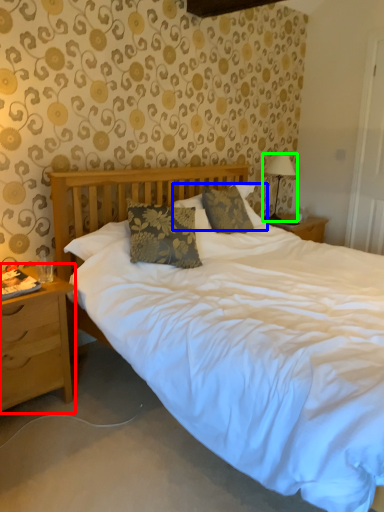
Question: Estimate the real-world distances between objects in this image. Which object is farther from nightstand (highlighted by a red box), pillow (highlighted by a blue box) or table lamp (highlighted by a green box)?

Choices:
 (A) pillow
 (B) table lamp

Answer: (B)